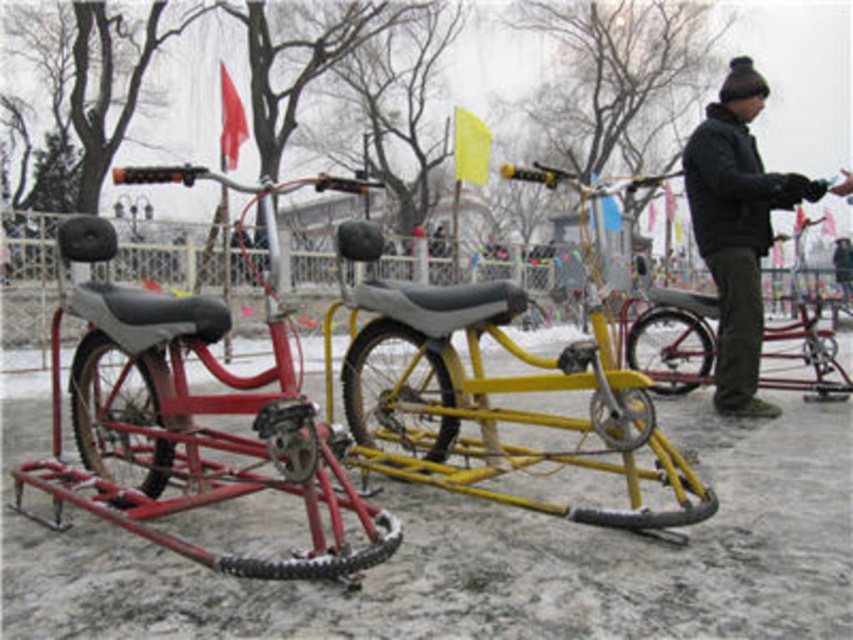
Between matte red bicycle at left and yellow matte bicycle at center, which one has less height?

yellow matte bicycle at center

Does matte red bicycle at left have a lesser width compared to yellow matte bicycle at center?

Yes.

Does point (115, 316) come farther from viewer compared to point (453, 349)?

No, it is not.

Locate an element on the screen. matte red bicycle at left is located at coordinates (196, 413).

Can you confirm if yellow matte bicycle at center is positioned to the left of black matte jacket at upper right?

Yes, yellow matte bicycle at center is to the left of black matte jacket at upper right.

Image resolution: width=853 pixels, height=640 pixels. I want to click on yellow matte bicycle at center, so click(498, 406).

This screenshot has height=640, width=853. Describe the element at coordinates (498, 406) in the screenshot. I see `yellow matte bicycle at center` at that location.

Image resolution: width=853 pixels, height=640 pixels. Identify the location of yellow matte bicycle at center. (498, 406).

Who is taller, black matte jacket at upper right or yellow matte bicycle at right?

black matte jacket at upper right is taller.

Is black matte jacket at upper right bigger than yellow matte bicycle at right?

Incorrect, black matte jacket at upper right is not larger than yellow matte bicycle at right.

You are a GUI agent. You are given a task and a screenshot of the screen. Output one action in this format:
    pyautogui.click(x=<x>, y=<y>)
    Task: Click on the black matte jacket at upper right
    The height and width of the screenshot is (640, 853).
    Given the screenshot: What is the action you would take?
    pyautogui.click(x=737, y=228)